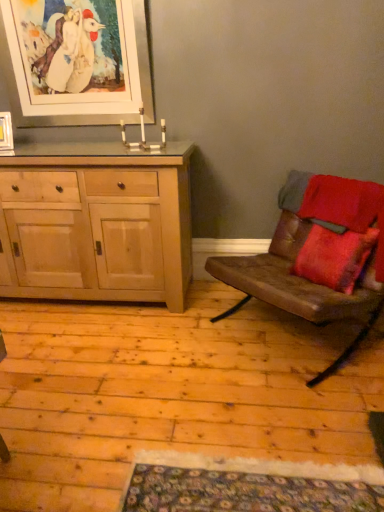
Question: From the image's perspective, is brown leather couch at right positioned above or below natural wood cabinet at left?

Choices:
 (A) above
 (B) below

Answer: (B)

Question: Looking at their shapes, would you say brown leather couch at right is wider or thinner than natural wood cabinet at left?

Choices:
 (A) thin
 (B) wide

Answer: (B)

Question: Based on their relative distances, which object is farther from the white matte picture frame at upper left, positioned as the second picture frame in bottom-to-top order?

Choices:
 (A) natural wood cabinet at left
 (B) matte wooden picture frame at upper left, acting as the 1th picture frame starting from the left
 (C) brown leather couch at right

Answer: (C)

Question: Which object is the farthest from the matte wooden picture frame at upper left, positioned as the 2th picture frame in top-to-bottom order?

Choices:
 (A) natural wood cabinet at left
 (B) white matte picture frame at upper left, marked as the second picture frame in a left-to-right arrangement
 (C) brown leather couch at right

Answer: (C)